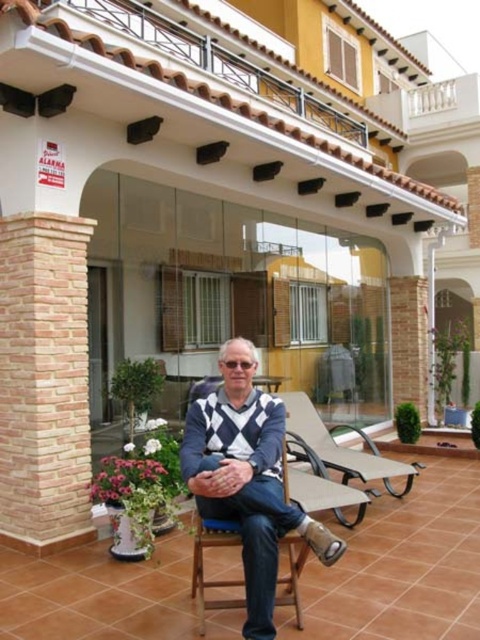
You are an interior designer planning to place a decorative item between the light brown brick pillar at left and the knitted sweater at center. Which object should the item be placed closer to if you want it to be near the narrower object?

The light brown brick pillar at left has a lesser width compared to the knitted sweater at center, so the decorative item should be placed closer to the light brown brick pillar at left to be near the narrower object.

You are a visitor standing on the patio and want to take a photo of the knitted sweater at center without including the light brown brick pillar at left in the frame. Is this possible given their positions?

The light brown brick pillar at left is positioned over the knitted sweater at center, so taking a photo of the knitted sweater at center without including the light brown brick pillar at left is not possible due to their overlapping positions.

You are standing on the patio and want to take a photo of both the point at coordinates point (26, 442) and the point at coordinates point (214, 406). Which point should you focus on first to ensure both are in focus?

You should focus on point (214, 406) first because it is closer to the camera than point (26, 442). This way, both points will be within the depth of field when focused on the closer point.